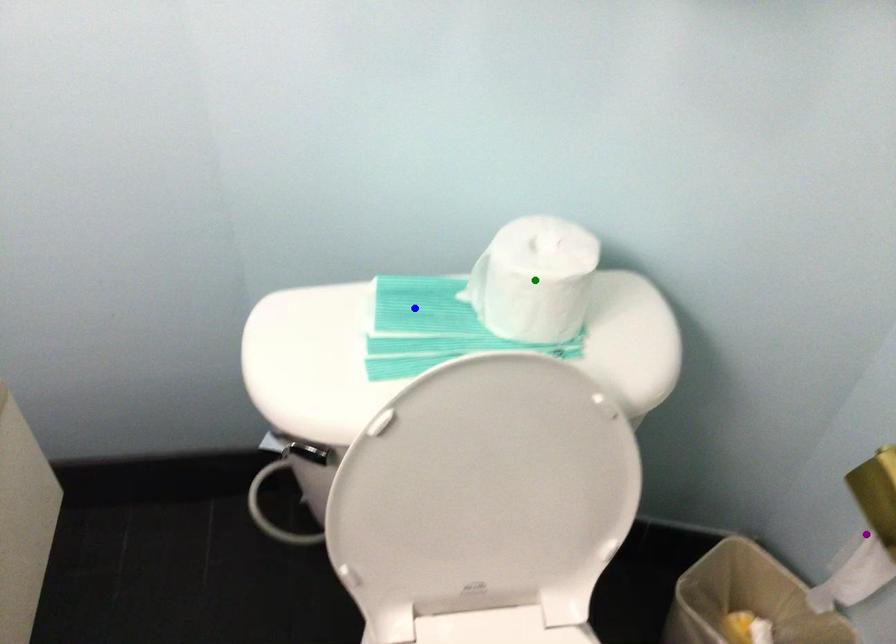
Order these from nearest to farthest:
purple point | blue point | green point

purple point < blue point < green point